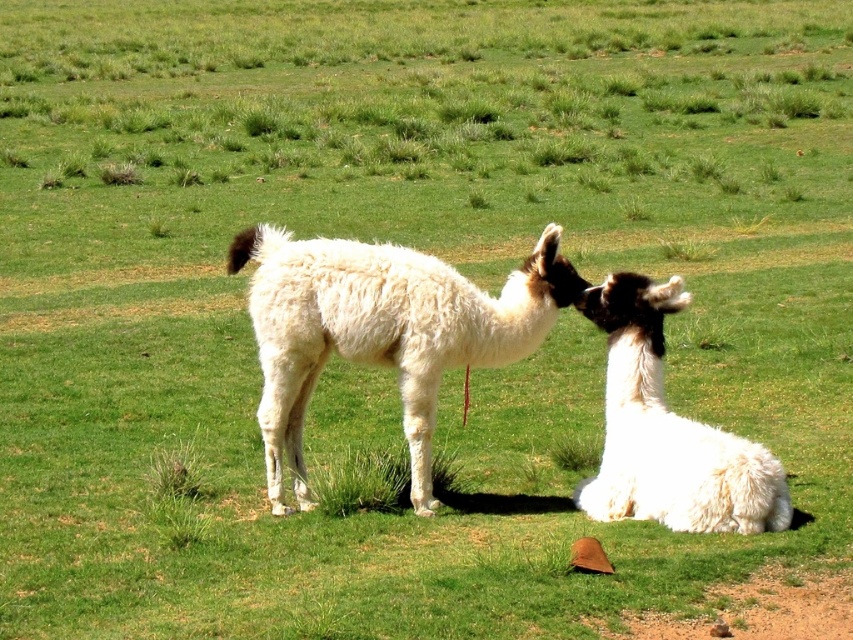
You are a photographer standing at the edge of the field where the white fluffy alpaca at center is located. You want to take a closeup photo of it without disturbing the animal. Given that your camera has a maximum zoom range of 20 feet, can you capture a clear closeup shot from your current position?

The white fluffy alpaca at center is 23.26 feet away from the camera. Since the camera can only zoom up to 20 feet, you cannot capture a clear closeup shot without moving closer.

You are a farmer checking on your alpacas in the field. You notice the white fluffy alpaca at center and the white fluffy alpaca at lower right. Which one is taller?

The white fluffy alpaca at center is taller than the white fluffy alpaca at lower right.